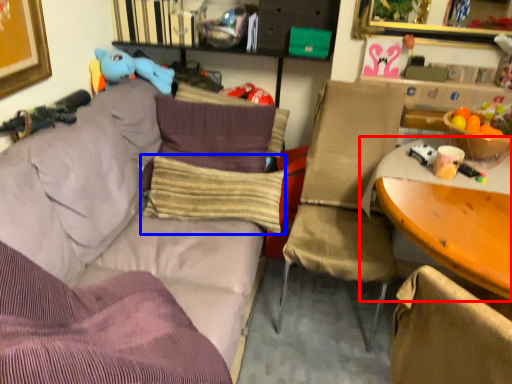
Question: Which object is further to the camera taking this photo, table (highlighted by a red box) or pillow (highlighted by a blue box)?

Choices:
 (A) table
 (B) pillow

Answer: (B)